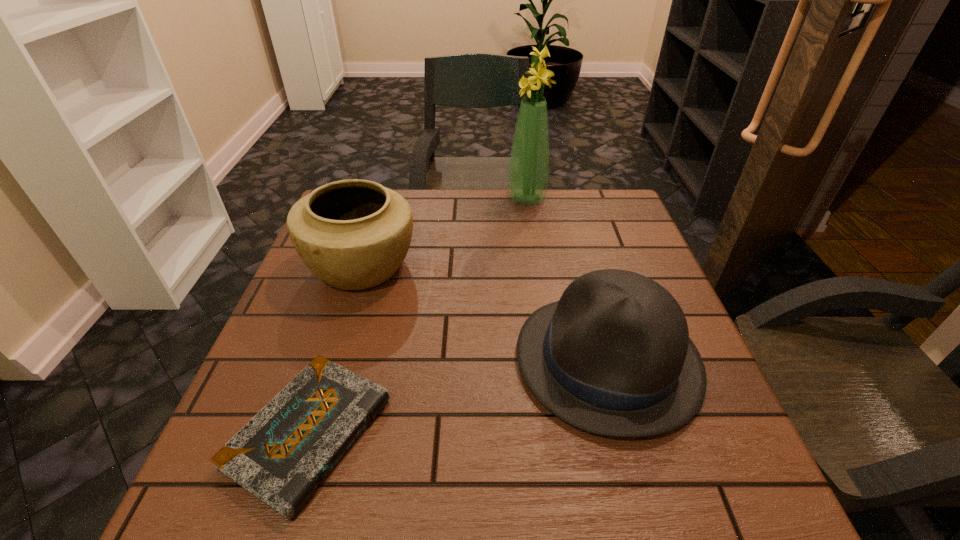
Find the location of a particular element. The height and width of the screenshot is (540, 960). vacant space that satisfies the following two spatial constraints: 1. on the front side of the shortest object; 2. on the right side of the pottery is located at coordinates (309, 433).